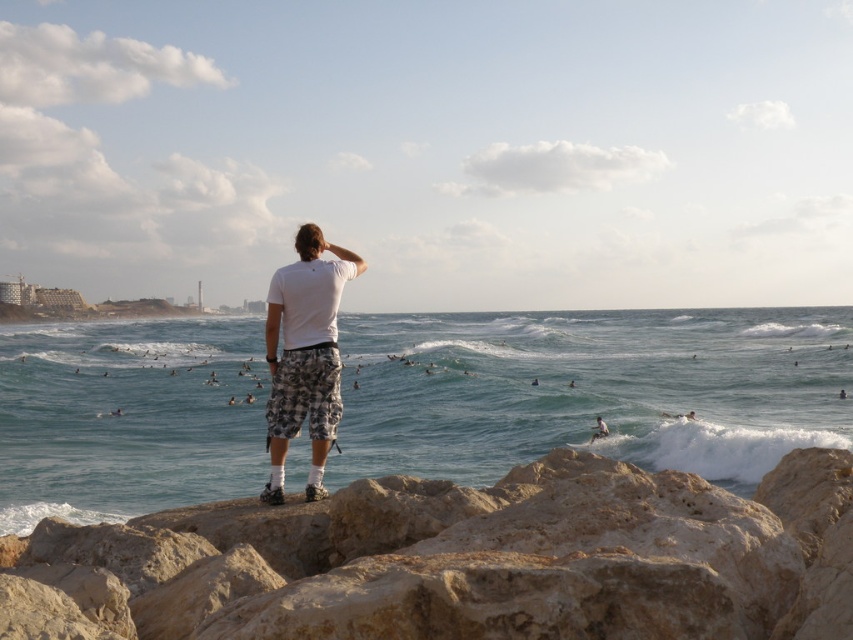
You are a photographer standing at the edge of the rocky outcrop in the scene. You want to capture a photo of the clear blue water at center. Based on the coordinates provided, in which direction should you point your camera relative to the rocky outcrop?

The clear blue water at center is located at coordinates point (590, 388), so you should point your camera towards the center of the image to capture it.

You are standing on the beach and see the clear blue water at center and the beige rock at center. Which object is located to the right side?

The clear blue water at center is positioned on the right side of beige rock at center.